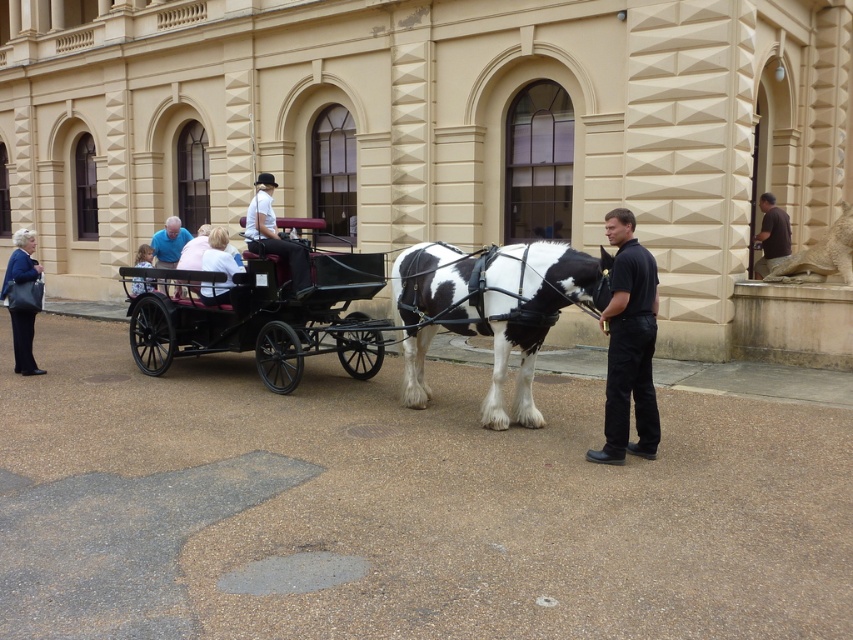
Question: Where is black polished wood horse cart at center located in relation to blue shirt at center in the image?

Choices:
 (A) right
 (B) left

Answer: (A)

Question: In this image, where is black polished wood horse cart at center located relative to light blue shirt at center?

Choices:
 (A) above
 (B) below

Answer: (B)

Question: Which of the following is the farthest from the observer?

Choices:
 (A) (39, 266)
 (B) (643, 413)
 (C) (418, 316)
 (D) (129, 308)

Answer: (A)

Question: Based on their relative distances, which object is nearer to the blue shirt at center?

Choices:
 (A) black and white speckled horse at center
 (B) white cotton shirt at center
 (C) light blue shirt at center
 (D) matte black jacket at left

Answer: (C)

Question: Which point is closer to the camera?

Choices:
 (A) blue shirt at center
 (B) brown leather jacket at lower right
 (C) black polished wood horse cart at center
 (D) black smooth shirt at center

Answer: (D)

Question: Is matte black jacket at left positioned before blue shirt at center?

Choices:
 (A) yes
 (B) no

Answer: (A)